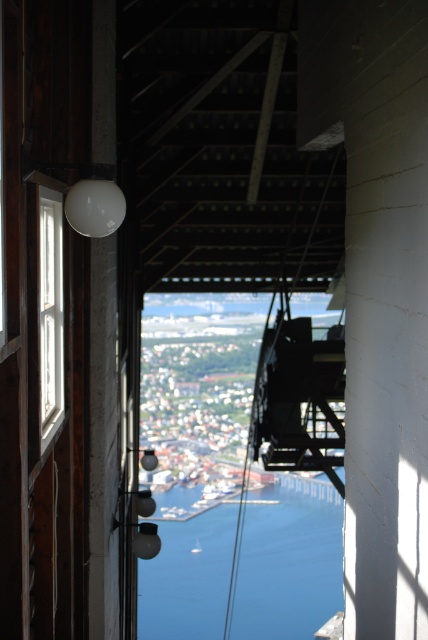
You are standing inside the structure and looking out the window. Where exactly is the blue water at center located in the image?

The blue water at center is located at point coordinates of 0.878 and 0.675.

You are standing inside the cable car station and want to see the view outside. Which object, the blue water at center or the white wooden window at left, allows you to see more of the landscape vertically?

The blue water at center has a greater height compared to the white wooden window at left, so it allows you to see more of the landscape vertically.